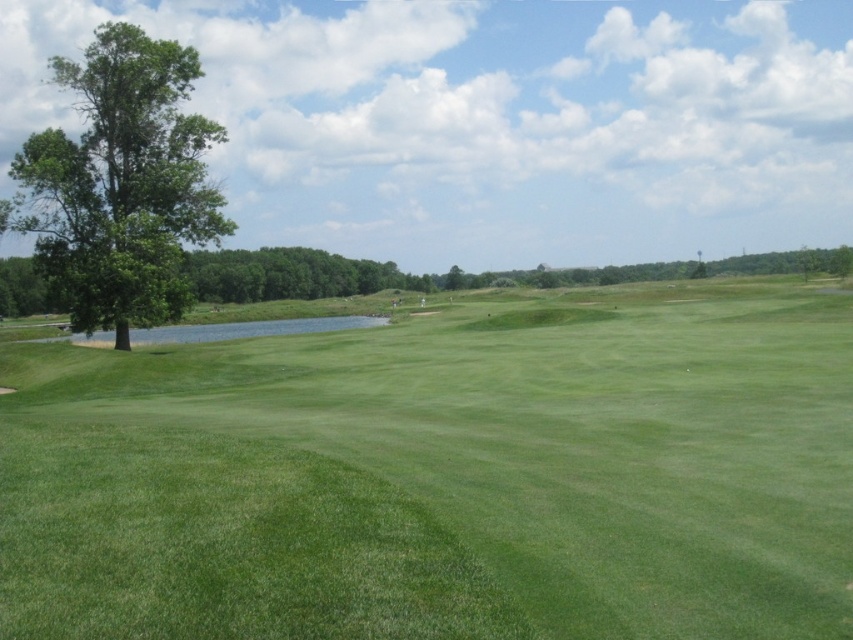
Is green grassy field at center thinner than green leafy tree at left?

Indeed, green grassy field at center has a lesser width compared to green leafy tree at left.

Which is in front, point (300, 385) or point (178, 305)?

Point (300, 385) is in front.

The image size is (853, 640). I want to click on green grassy field at center, so coord(445,476).